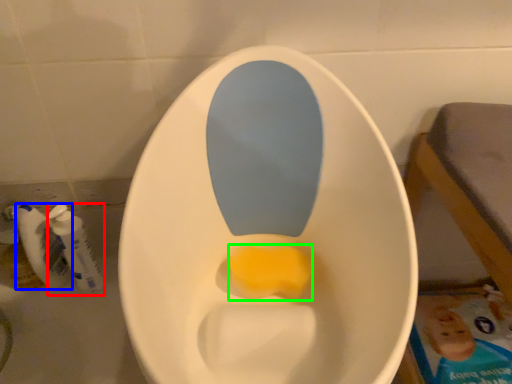
Question: Which object is positioned closest to mouthwash (highlighted by a red box)? Select from mouthwash (highlighted by a blue box) and food (highlighted by a green box).

Choices:
 (A) mouthwash
 (B) food

Answer: (A)